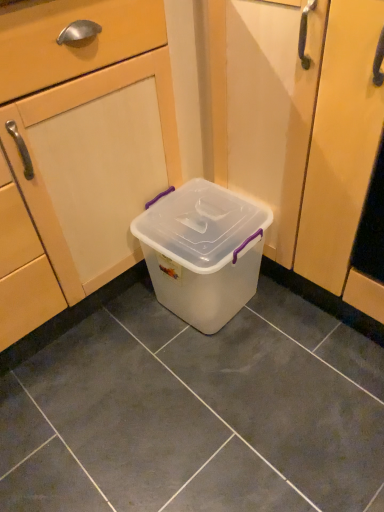
Locate an element on the screen. Image resolution: width=384 pixels, height=512 pixels. free space to the left of transparent plastic storage box at center is located at coordinates (113, 331).